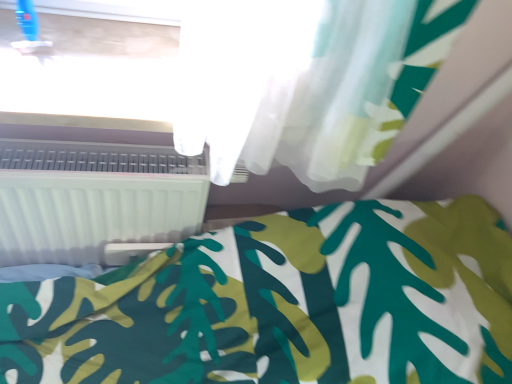
Where is `white plastic radiator at lower left`? The width and height of the screenshot is (512, 384). white plastic radiator at lower left is located at coordinates (94, 198).

Measure the distance between white plastic window frame at upper center and camera.

white plastic window frame at upper center and camera are 27.06 inches apart.

Image resolution: width=512 pixels, height=384 pixels. What do you see at coordinates (284, 304) in the screenshot?
I see `white fabric bed at lower right` at bounding box center [284, 304].

Find the location of a particular element. white plastic radiator at lower left is located at coordinates (94, 198).

In the scene shown: Who is more distant, white plastic window frame at upper center or white fabric bed at lower right?

white plastic window frame at upper center is further from the camera.

Based on the photo, is white plastic window frame at upper center aimed at white fabric bed at lower right?

No, white plastic window frame at upper center is not oriented towards white fabric bed at lower right.

Measure the distance from white plastic window frame at upper center to white fabric bed at lower right.

A distance of 19.50 inches exists between white plastic window frame at upper center and white fabric bed at lower right.

Between white plastic window frame at upper center and white fabric bed at lower right, which one appears on the left side from the viewer's perspective?

white plastic window frame at upper center.

Could white plastic radiator at lower left be considered to be inside white plastic window frame at upper center?

No.

Between white plastic window frame at upper center and white plastic radiator at lower left, which one has larger size?

white plastic radiator at lower left is bigger.

Which point is more forward, (124, 37) or (21, 191)?

Point (21, 191)

Considering the positions of objects white plastic window frame at upper center and white plastic radiator at lower left in the image provided, who is more to the left, white plastic window frame at upper center or white plastic radiator at lower left?

From the viewer's perspective, white plastic radiator at lower left appears more on the left side.

Can you confirm if white plastic radiator at lower left is positioned to the left of white plastic window frame at upper center?

Yes, white plastic radiator at lower left is to the left of white plastic window frame at upper center.

From the image's perspective, is white plastic radiator at lower left over white plastic window frame at upper center?

Actually, white plastic radiator at lower left appears below white plastic window frame at upper center in the image.

Identify the location of air conditioning below the white plastic window frame at upper center (from the image's perspective). The height and width of the screenshot is (384, 512). (94, 198).

Between white plastic radiator at lower left and white plastic window frame at upper center, which one has larger width?

Wider between the two is white plastic window frame at upper center.

Based on the photo, could you tell me if white fabric bed at lower right is facing white plastic window frame at upper center?

No.

Locate an element on the screen. This screenshot has height=384, width=512. window frame on the left side of white fabric bed at lower right is located at coordinates (88, 72).

Is white fabric bed at lower right to the left of white plastic window frame at upper center from the viewer's perspective?

In fact, white fabric bed at lower right is to the right of white plastic window frame at upper center.

Considering the positions of objects white plastic radiator at lower left and white fabric bed at lower right in the image provided, who is in front, white plastic radiator at lower left or white fabric bed at lower right?

white fabric bed at lower right is closer to the camera.

Are white plastic radiator at lower left and white fabric bed at lower right located far from each other?

No, white plastic radiator at lower left is in close proximity to white fabric bed at lower right.

Who is shorter, white plastic radiator at lower left or white fabric bed at lower right?

Standing shorter between the two is white plastic radiator at lower left.

From the image's perspective, would you say white plastic radiator at lower left is shown under white fabric bed at lower right?

Incorrect, from the image's perspective, white plastic radiator at lower left is higher than white fabric bed at lower right.

From the image's perspective, who appears lower, white fabric bed at lower right or white plastic radiator at lower left?

From the image's view, white fabric bed at lower right is below.

Between white fabric bed at lower right and white plastic radiator at lower left, which one is positioned in front?

white fabric bed at lower right.

Does white fabric bed at lower right have a lesser width compared to white plastic radiator at lower left?

No, white fabric bed at lower right is not thinner than white plastic radiator at lower left.

Is white fabric bed at lower right positioned with its back to white plastic radiator at lower left?

That's not correct — white fabric bed at lower right is not looking away from white plastic radiator at lower left.

Where is `bed that is below the white plastic window frame at upper center (from the image's perspective)`? The image size is (512, 384). bed that is below the white plastic window frame at upper center (from the image's perspective) is located at coordinates (284, 304).

Identify the location of air conditioning behind the white plastic window frame at upper center. (94, 198).

Looking at the image, which one is located further to white plastic radiator at lower left, white plastic window frame at upper center or white fabric bed at lower right?

white fabric bed at lower right is further to white plastic radiator at lower left.

Considering their positions, is white plastic radiator at lower left positioned closer to white plastic window frame at upper center than white fabric bed at lower right?

white plastic radiator at lower left is closer to white plastic window frame at upper center.

When comparing their distances from white plastic window frame at upper center, does white fabric bed at lower right or white plastic radiator at lower left seem closer?

The object closer to white plastic window frame at upper center is white plastic radiator at lower left.

Which object lies further to the anchor point white fabric bed at lower right, white plastic window frame at upper center or white plastic radiator at lower left?

white plastic window frame at upper center lies further to white fabric bed at lower right than the other object.

Estimate the real-world distances between objects in this image. Which object is closer to white plastic radiator at lower left, white fabric bed at lower right or white plastic window frame at upper center?

white plastic window frame at upper center.

In the scene shown: Considering their positions, is white plastic radiator at lower left positioned further to white fabric bed at lower right than white plastic window frame at upper center?

Based on the image, white plastic window frame at upper center appears to be further to white fabric bed at lower right.

This screenshot has height=384, width=512. I want to click on air conditioning between white plastic window frame at upper center and white fabric bed at lower right vertically, so click(x=94, y=198).